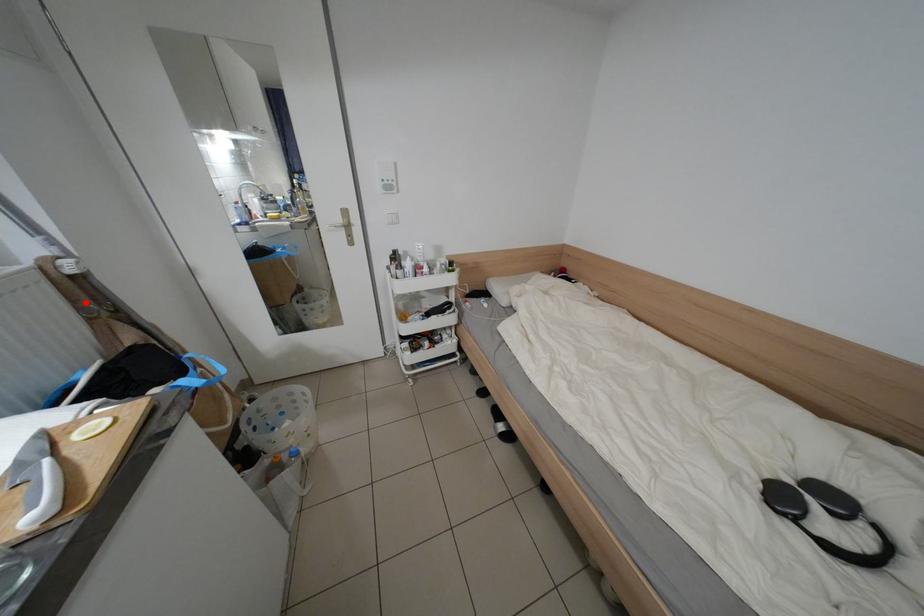
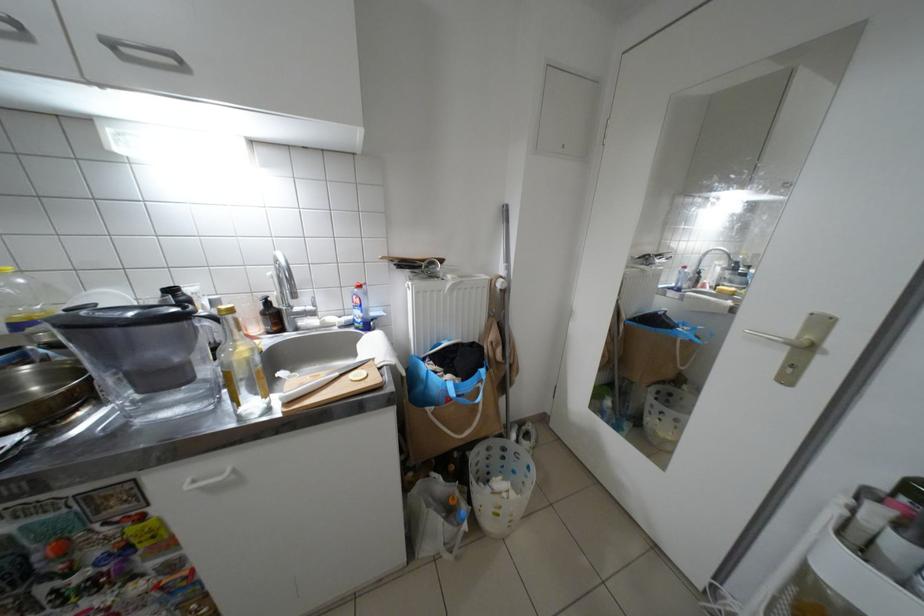
Locate, in the second image, the point that corresponds to the highlighted location in the first image.

(502, 304)